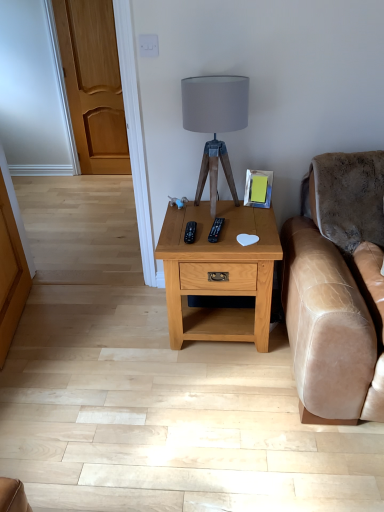
Locate an element on the screen. The height and width of the screenshot is (512, 384). vacant space underneath matte gray fabric lampshade at center (from a real-world perspective) is located at coordinates (223, 204).